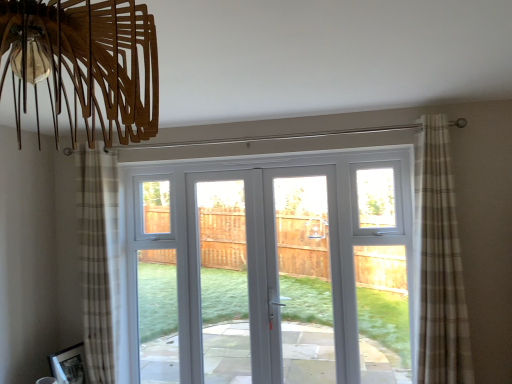
Question: Can you confirm if white glossy door at center is wider than beige plaid curtain at right, which is counted as the first curtain, starting from the right?

Choices:
 (A) yes
 (B) no

Answer: (B)

Question: Are white glossy door at center and beige plaid curtain at right, arranged as the 2th curtain when viewed from the back, beside each other?

Choices:
 (A) yes
 (B) no

Answer: (B)

Question: Does white glossy door at center turn towards beige plaid curtain at right, positioned as the second curtain in left-to-right order?

Choices:
 (A) no
 (B) yes

Answer: (B)

Question: Is beige plaid curtain at right, arranged as the 2th curtain when viewed from the back, located within white glossy door at center?

Choices:
 (A) yes
 (B) no

Answer: (B)

Question: Considering the relative sizes of white glossy door at center and beige plaid curtain at right, arranged as the 2th curtain when viewed from the back, in the image provided, is white glossy door at center bigger than beige plaid curtain at right, arranged as the 2th curtain when viewed from the back,?

Choices:
 (A) no
 (B) yes

Answer: (B)

Question: Is white glossy door at center wider or thinner than beige plaid curtain at right, arranged as the 2th curtain when viewed from the back?

Choices:
 (A) wide
 (B) thin

Answer: (B)

Question: Considering the positions of white glossy door at center and beige plaid curtain at right, acting as the first curtain starting from the front, in the image, is white glossy door at center taller or shorter than beige plaid curtain at right, acting as the first curtain starting from the front,?

Choices:
 (A) tall
 (B) short

Answer: (B)

Question: From the image's perspective, is white glossy door at center located above or below beige plaid curtain at right, which is counted as the first curtain, starting from the right?

Choices:
 (A) above
 (B) below

Answer: (B)

Question: Does point (285, 256) appear closer or farther from the camera than point (426, 291)?

Choices:
 (A) closer
 (B) farther

Answer: (B)

Question: From their relative heights in the image, would you say white glossy door at center is taller or shorter than beige plaid curtain at left, the 2th curtain viewed from the front?

Choices:
 (A) short
 (B) tall

Answer: (A)

Question: Is white glossy door at center to the left or to the right of beige plaid curtain at left, the 2th curtain viewed from the front, in the image?

Choices:
 (A) right
 (B) left

Answer: (A)

Question: Looking at the image, does white glossy door at center seem bigger or smaller compared to beige plaid curtain at left, the 1th curtain positioned from the back?

Choices:
 (A) small
 (B) big

Answer: (B)

Question: From a real-world perspective, is white glossy door at center positioned above or below beige plaid curtain at left, which ranks as the 2th curtain in right-to-left order?

Choices:
 (A) below
 (B) above

Answer: (A)

Question: Considering the positions of beige plaid curtain at left, the 1th curtain positioned from the back, and white glossy door at center in the image, is beige plaid curtain at left, the 1th curtain positioned from the back, bigger or smaller than white glossy door at center?

Choices:
 (A) big
 (B) small

Answer: (B)

Question: Which is correct: beige plaid curtain at left, the 2th curtain viewed from the front, is inside white glossy door at center, or outside of it?

Choices:
 (A) inside
 (B) outside

Answer: (B)